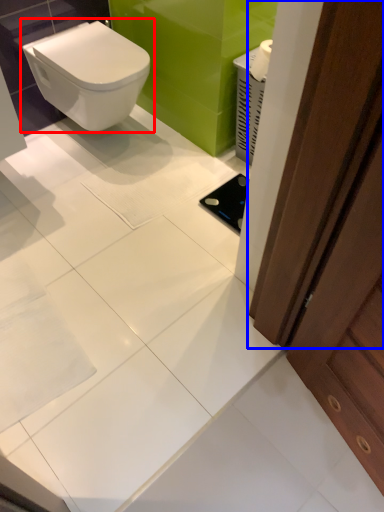
Question: Which object is closer to the camera taking this photo, toilet (highlighted by a red box) or screen door (highlighted by a blue box)?

Choices:
 (A) toilet
 (B) screen door

Answer: (B)